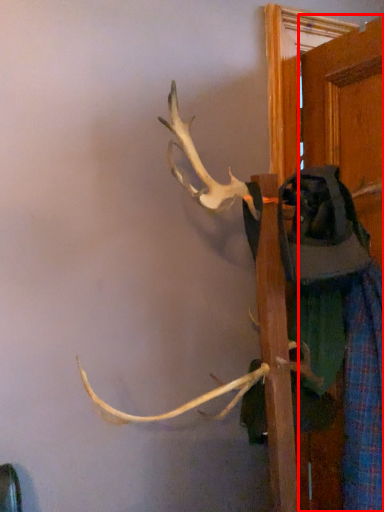
Question: From the image's perspective, what is the correct spatial relationship of door (annotated by the red box) in relation to clothing?

Choices:
 (A) below
 (B) above

Answer: (B)